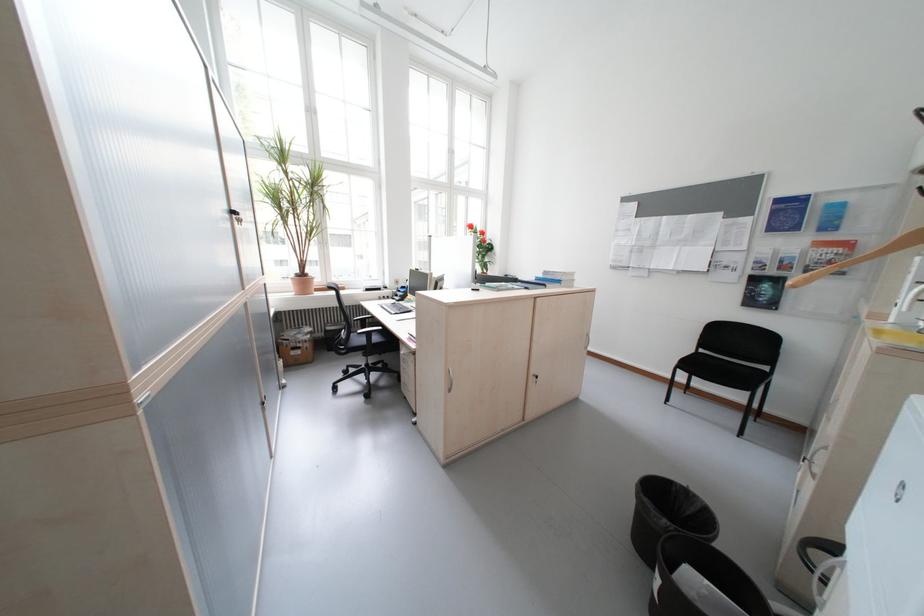
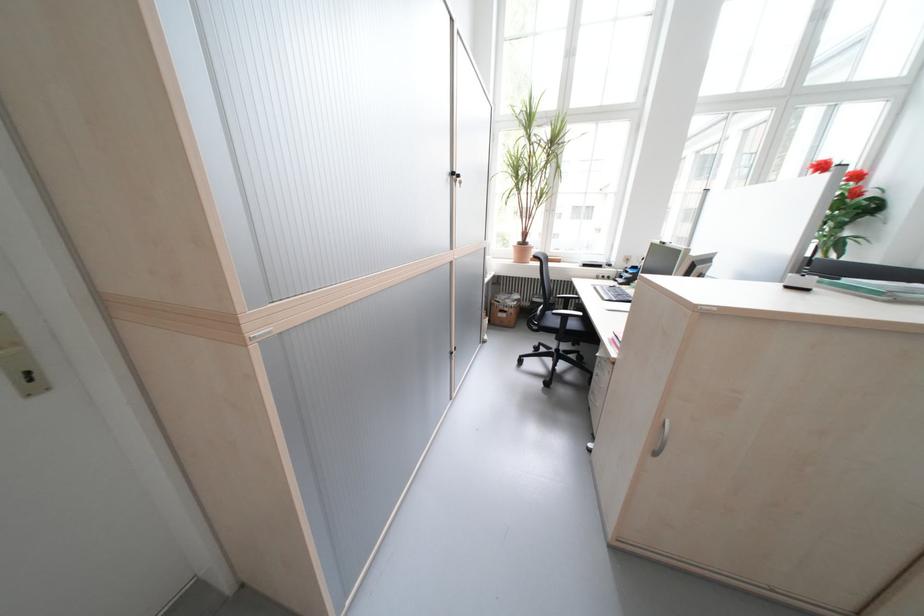
In the second image, find the point that corresponds to point (386, 339) in the first image.

(582, 326)